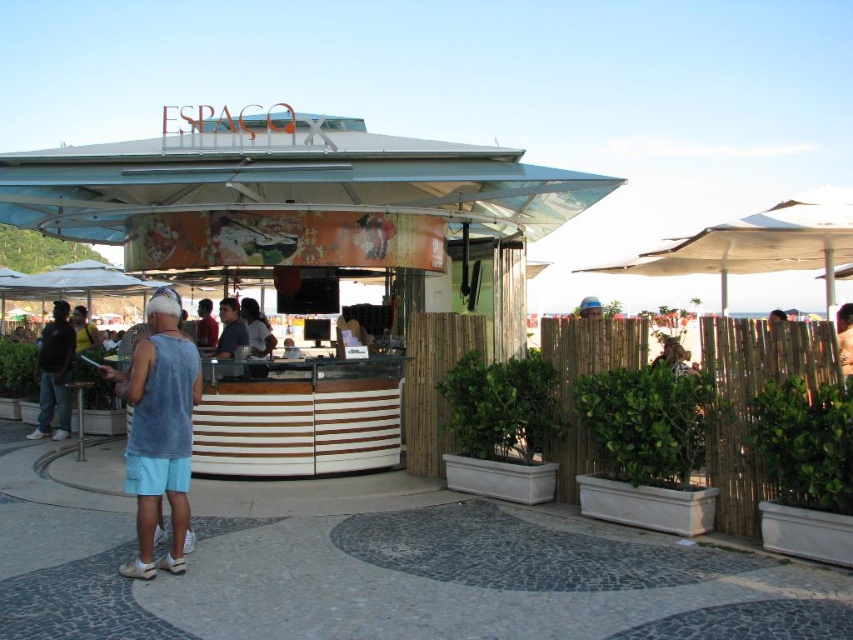
You are a customer at the kiosk and want to order a drink. You notice two people in the line wearing tank tops. One is wearing a dark gray tank top at left and another in a blue cotton tank top at center. Which person is positioned closer to the counter?

The blue cotton tank top at center is to the right of the dark gray tank top at left, so the person in the blue cotton tank top at center is closer to the counter.

You are standing at the entrance of the kiosk and want to place two items on the counter. The first item must be placed at point [160,372] and the second at point [74,342]. Which item will appear closer to you when viewed from your current position?

The item placed at point [160,372] will appear closer to you because it is closer to the viewer than point [74,342].